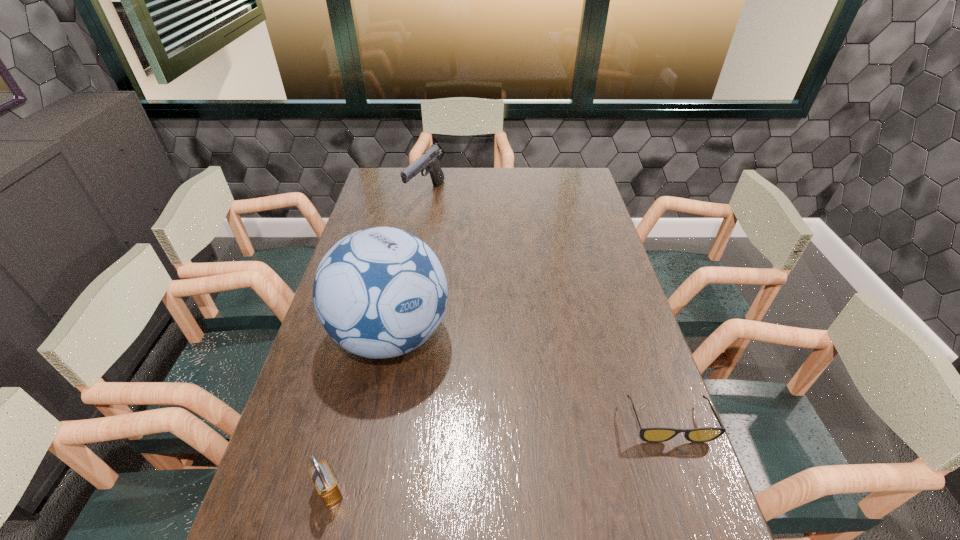
Locate an element on the screen. This screenshot has height=540, width=960. object located at the right edge is located at coordinates (650, 434).

Identify the location of object that is at the near left corner. This screenshot has width=960, height=540. (323, 479).

Where is `vacant space at the far edge`? vacant space at the far edge is located at coordinates (457, 174).

Where is `vacant space at the left edge of the desktop`? vacant space at the left edge of the desktop is located at coordinates (393, 207).

Identify the location of free location at the right edge of the desktop. The height and width of the screenshot is (540, 960). [x=587, y=281].

Find the location of `free space at the far left corner of the desktop`. free space at the far left corner of the desktop is located at coordinates (399, 172).

The height and width of the screenshot is (540, 960). I want to click on vacant space at the near left corner of the desktop, so click(x=303, y=511).

Find the location of a particular element. vacant area that lies between the shortest object and the third tallest object is located at coordinates (499, 456).

Where is `empty space between the nearest object and the tallest object`? This screenshot has height=540, width=960. empty space between the nearest object and the tallest object is located at coordinates (360, 413).

Locate an element on the screen. This screenshot has width=960, height=540. free space between the third shortest object and the rightmost object is located at coordinates (547, 308).